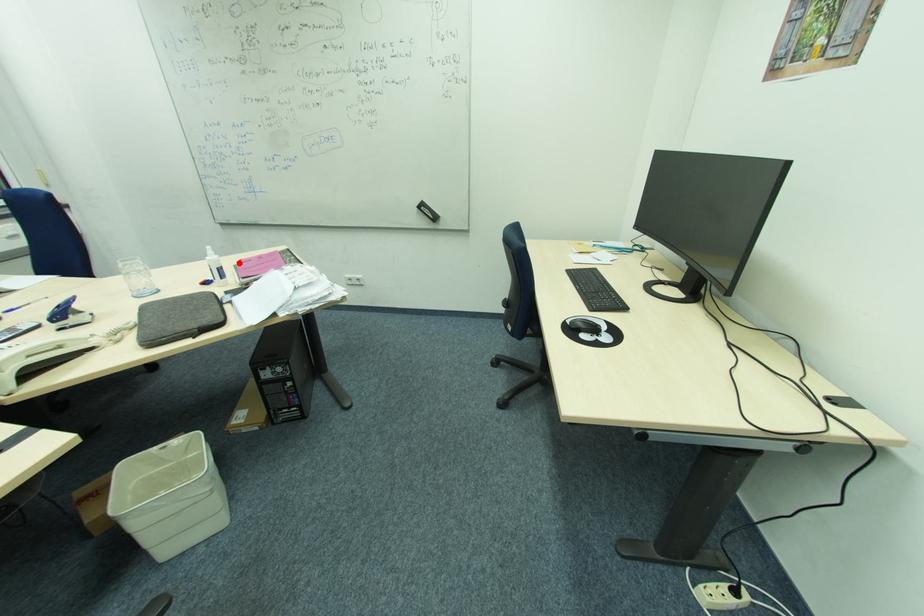
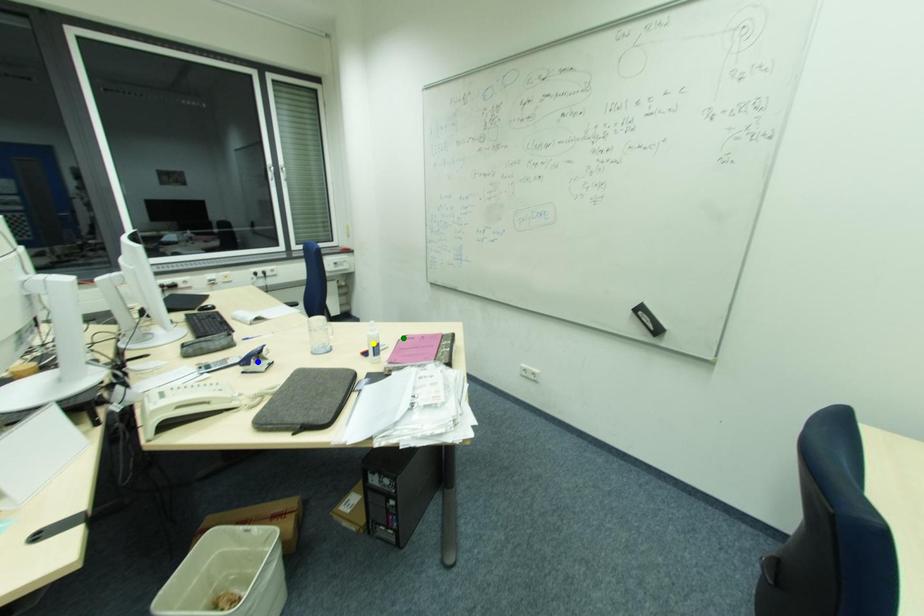
Question: I am providing you with two images of the same scene from different viewpoints. A red point is marked on the first image. You are given multiple points on the second image. Which spot in image 2 lines up with the point in image 1?

Choices:
 (A) blue point
 (B) green point
 (C) yellow point

Answer: (B)